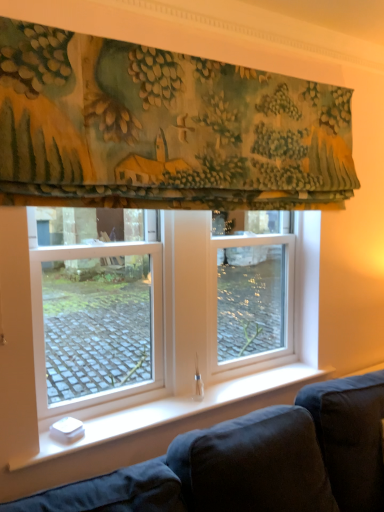
Locate an element on the screen. The width and height of the screenshot is (384, 512). textured green fabric at upper center is located at coordinates (163, 128).

Is dark blue fabric couch at lower left not inside textured green fabric at upper center?

That's correct, dark blue fabric couch at lower left is outside of textured green fabric at upper center.

In the scene shown: Is dark blue fabric couch at lower left positioned in front of textured green fabric at upper center?

No, dark blue fabric couch at lower left is behind textured green fabric at upper center.

Measure the distance from dark blue fabric couch at lower left to textured green fabric at upper center.

dark blue fabric couch at lower left and textured green fabric at upper center are 3.32 feet apart from each other.

Considering the relative positions of dark blue fabric couch at lower left and textured green fabric at upper center in the image provided, is dark blue fabric couch at lower left to the right of textured green fabric at upper center from the viewer's perspective?

No.

Which is more to the left, clear glass window at center or textured green fabric at upper center?

Positioned to the left is clear glass window at center.

Is clear glass window at center outside of textured green fabric at upper center?

Absolutely, clear glass window at center is external to textured green fabric at upper center.

From the image's perspective, between clear glass window at center and textured green fabric at upper center, who is located below?

clear glass window at center.

Would you say dark blue fabric couch at lower left is inside or outside clear glass window at center?

dark blue fabric couch at lower left cannot be found inside clear glass window at center.

Considering the positions of objects dark blue fabric couch at lower left and clear glass window at center in the image provided, who is more to the right, dark blue fabric couch at lower left or clear glass window at center?

dark blue fabric couch at lower left.

In the image, there is a dark blue fabric couch at lower left. In order to click on curtain above it (from the image's perspective) in this screenshot , I will do pyautogui.click(x=163, y=128).

Would you say textured green fabric at upper center contains dark blue fabric couch at lower left?

No, dark blue fabric couch at lower left is not inside textured green fabric at upper center.

Which is in front, point (177, 144) or point (379, 486)?

The point (177, 144) is closer to the camera.

From the image's perspective, who appears lower, textured green fabric at upper center or dark blue fabric couch at lower left?

dark blue fabric couch at lower left.

Is textured green fabric at upper center facing towards clear glass window at center?

No, textured green fabric at upper center is not turned towards clear glass window at center.

Who is bigger, textured green fabric at upper center or clear glass window at center?

With larger size is textured green fabric at upper center.

Which of these two, textured green fabric at upper center or clear glass window at center, is thinner?

clear glass window at center is thinner.

From the image's perspective, between clear glass window at center and dark blue fabric couch at lower left, who is located below?

From the image's view, dark blue fabric couch at lower left is below.

Is the position of clear glass window at center more distant than that of dark blue fabric couch at lower left?

Yes.

Is clear glass window at center looking in the opposite direction of dark blue fabric couch at lower left?

No, dark blue fabric couch at lower left is not at the back of clear glass window at center.

From a real-world perspective, is clear glass window at center below dark blue fabric couch at lower left?

No, from a real-world perspective, clear glass window at center is not under dark blue fabric couch at lower left.

You are a GUI agent. You are given a task and a screenshot of the screen. Output one action in this format:
    pyautogui.click(x=<x>, y=<y>)
    Task: Click on the studio couch beneath the textured green fabric at upper center (from a real-world perspective)
    
    Given the screenshot: What is the action you would take?
    pyautogui.click(x=254, y=462)

There is a clear glass window at center. At what (x,y) coordinates should I click in order to perform the action: click on curtain above it (from a real-world perspective). Please return your answer as a coordinate pair (x, y). This screenshot has height=512, width=384. Looking at the image, I should click on (163, 128).

When comparing their distances from clear glass window at center, does dark blue fabric couch at lower left or textured green fabric at upper center seem further?

Based on the image, dark blue fabric couch at lower left appears to be further to clear glass window at center.

Which object lies further to the anchor point dark blue fabric couch at lower left, textured green fabric at upper center or clear glass window at center?

textured green fabric at upper center is further to dark blue fabric couch at lower left.

Looking at this image, based on their spatial positions, is clear glass window at center or dark blue fabric couch at lower left closer to textured green fabric at upper center?

The object closer to textured green fabric at upper center is clear glass window at center.

Which object lies further to the anchor point dark blue fabric couch at lower left, clear glass window at center or textured green fabric at upper center?

textured green fabric at upper center lies further to dark blue fabric couch at lower left than the other object.

When comparing their distances from textured green fabric at upper center, does dark blue fabric couch at lower left or clear glass window at center seem further?

dark blue fabric couch at lower left is further to textured green fabric at upper center.

Which object lies nearer to the anchor point clear glass window at center, textured green fabric at upper center or dark blue fabric couch at lower left?

textured green fabric at upper center is closer to clear glass window at center.

You are a GUI agent. You are given a task and a screenshot of the screen. Output one action in this format:
    pyautogui.click(x=<x>, y=<y>)
    Task: Click on the window between textured green fabric at upper center and dark blue fabric couch at lower left in the up-down direction
    
    Given the screenshot: What is the action you would take?
    pyautogui.click(x=153, y=310)